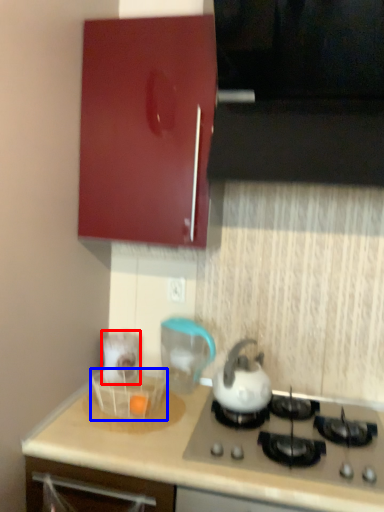
Question: Which point is closer to the camera, appliance (highlighted by a red box) or basket (highlighted by a blue box)?

Choices:
 (A) appliance
 (B) basket

Answer: (B)